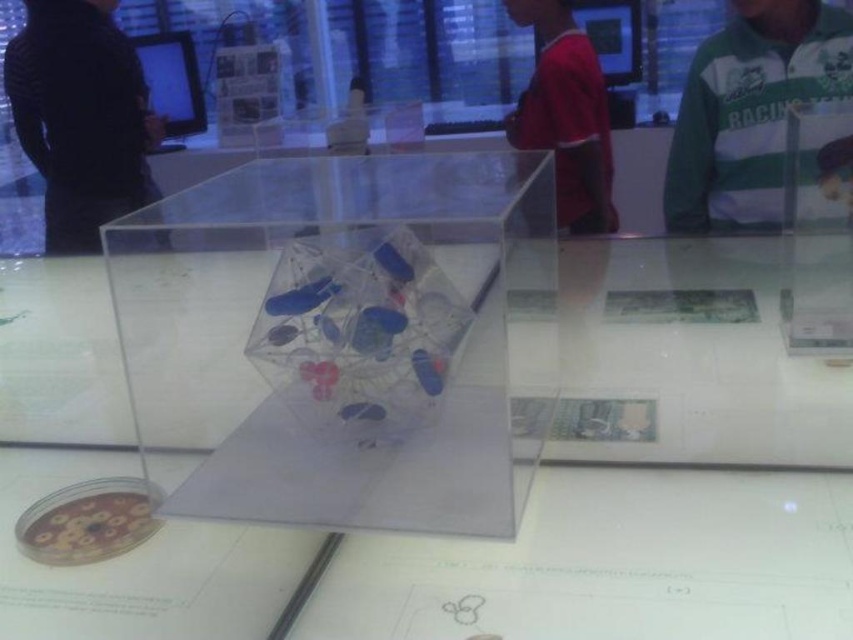
Question: Which point is closer to the camera?

Choices:
 (A) (569, 74)
 (B) (221, 298)
 (C) (752, 173)

Answer: (B)

Question: Which object appears closest to the camera in this image?

Choices:
 (A) black matte jacket at left
 (B) transparent plastic table at center
 (C) transparent acrylic cube at center
 (D) red shirt at center

Answer: (C)

Question: Is transparent acrylic cube at center above red shirt at center?

Choices:
 (A) no
 (B) yes

Answer: (A)

Question: Does transparent acrylic cube at center lie in front of green and white jersey at upper right?

Choices:
 (A) no
 (B) yes

Answer: (B)

Question: Which object is the closest to the transparent plastic table at center?

Choices:
 (A) red shirt at center
 (B) green and white jersey at upper right
 (C) transparent acrylic cube at center

Answer: (C)

Question: Does transparent acrylic cube at center have a smaller size compared to black matte jacket at left?

Choices:
 (A) yes
 (B) no

Answer: (A)